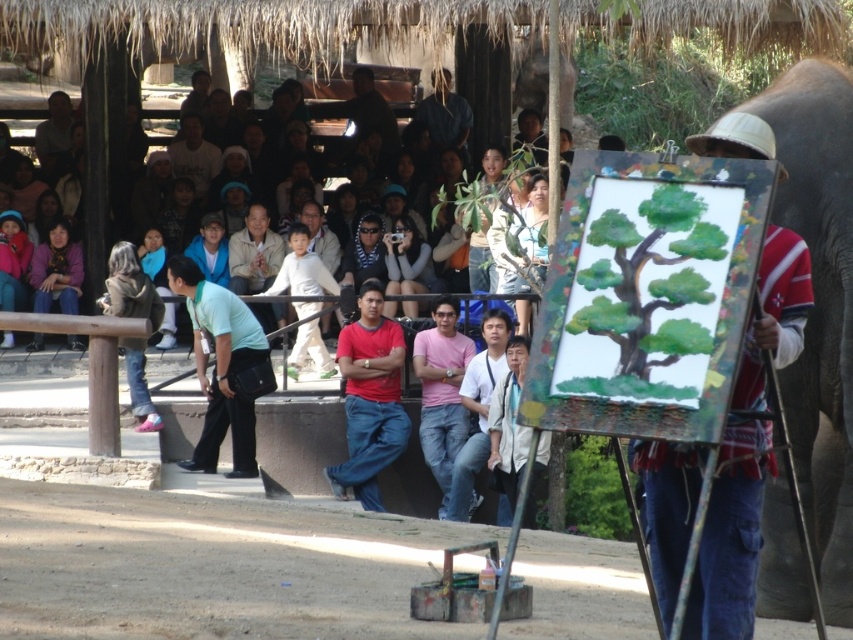
Based on the photo, is green matte tree at center to the right of light green fabric shirt at center from the viewer's perspective?

Indeed, green matte tree at center is positioned on the right side of light green fabric shirt at center.

Who is more distant from viewer, (596,300) or (219,358)?

Positioned behind is point (219,358).

Find the location of `green matte tree at center`. green matte tree at center is located at coordinates (646, 289).

Looking at this image, is the position of green matte tree at center less distant than that of light brown shirt at upper left?

Yes.

Locate an element on the screen. green matte tree at center is located at coordinates (646, 289).

Who is more forward, (x=341, y=481) or (x=480, y=332)?

Point (x=341, y=481) is in front.

Which is more to the right, red matte shirt at center or white matte shirt at center?

white matte shirt at center

Where is `red matte shirt at center`? red matte shirt at center is located at coordinates (369, 397).